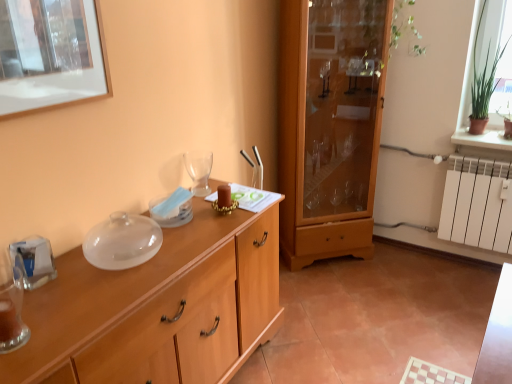
The width and height of the screenshot is (512, 384). Describe the element at coordinates (330, 125) in the screenshot. I see `wooden cabinet at center` at that location.

Find the location of `translucent glass vase at left`. translucent glass vase at left is located at coordinates (12, 315).

What is the approximate width of transparent glass wine glass at center?

It is 11.53 centimeters.

The image size is (512, 384). Identify the location of wooden picture frame at upper left. (51, 54).

In the image, is wooden picture frame at upper left on the left side or the right side of translucent glass vase at left?

Based on their positions, wooden picture frame at upper left is located to the right of translucent glass vase at left.

Locate an element on the screen. The width and height of the screenshot is (512, 384). tableware that appears in front of the wooden picture frame at upper left is located at coordinates (12, 315).

Is wooden picture frame at upper left not near translucent glass vase at left?

No, wooden picture frame at upper left is in close proximity to translucent glass vase at left.

Which object is closer to the camera, wooden cabinet at center or transparent glass wine glass at center?

transparent glass wine glass at center is more forward.

Locate an element on the screen. wine glass lying in front of the wooden cabinet at center is located at coordinates (199, 170).

Consider the image. Is wooden cabinet at center looking in the opposite direction of transparent glass wine glass at center?

No, transparent glass wine glass at center is not at the back of wooden cabinet at center.

Is wooden cabinet at center smaller than wooden picture frame at upper left?

Incorrect, wooden cabinet at center is not smaller in size than wooden picture frame at upper left.

Relative to wooden picture frame at upper left, is wooden cabinet at center in front or behind?

In the image, wooden cabinet at center appears behind wooden picture frame at upper left.

From the image's perspective, is wooden cabinet at center located above wooden picture frame at upper left?

No.

Can wooden cabinet at center be found inside wooden cabinet at center?

No.

Is wooden cabinet at center far from wooden cabinet at center?

wooden cabinet at center is far away from wooden cabinet at center.

From a real-world perspective, between wooden cabinet at center and wooden cabinet at center, who is vertically higher?

From a 3D spatial view, wooden cabinet at center is above.

From the picture: Is wooden cabinet at center behind wooden cabinet at center?

No, wooden cabinet at center is closer to the camera.

Between translucent glass vase at left and wooden cabinet at center, which one has larger size?

wooden cabinet at center.

From a real-world perspective, is translucent glass vase at left physically located above or below wooden cabinet at center?

translucent glass vase at left is situated higher than wooden cabinet at center in the real world.

Measure the distance between translucent glass vase at left and wooden cabinet at center.

They are 6.23 feet apart.

Considering the sizes of objects translucent glass vase at left and wooden cabinet at center in the image provided, who is taller, translucent glass vase at left or wooden cabinet at center?

Standing taller between the two is wooden cabinet at center.

Is point (1, 312) positioned before point (99, 46)?

Yes.

Is translucent glass vase at left not inside wooden picture frame at upper left?

That's correct, translucent glass vase at left is outside of wooden picture frame at upper left.

Is translucent glass vase at left thinner than wooden picture frame at upper left?

Incorrect, the width of translucent glass vase at left is not less than that of wooden picture frame at upper left.

Looking at the image, does wooden picture frame at upper left seem bigger or smaller compared to wooden cabinet at center?

Considering their sizes, wooden picture frame at upper left takes up less space than wooden cabinet at center.

Which object is positioned more to the left, wooden picture frame at upper left or wooden cabinet at center?

wooden picture frame at upper left.

From the image's perspective, who appears lower, wooden picture frame at upper left or wooden cabinet at center?

wooden cabinet at center is shown below in the image.

Does wooden picture frame at upper left come in front of wooden cabinet at center?

No, wooden picture frame at upper left is further to the viewer.

Identify the location of tableware in front of the wooden picture frame at upper left. (12, 315).

At what (x,y) coordinates should I click in order to perform the action: click on wine glass that is above the wooden cabinet at center (from a real-world perspective). Please return your answer as a coordinate pair (x, y). This screenshot has width=512, height=384. Looking at the image, I should click on (199, 170).

When comparing their distances from wooden cabinet at center, does transparent glass wine glass at center or translucent glass vase at left seem closer?

translucent glass vase at left is positioned closer to the anchor wooden cabinet at center.

When comparing their distances from wooden cabinet at center, does translucent glass vase at left or wooden picture frame at upper left seem further?

The object further to wooden cabinet at center is wooden picture frame at upper left.

Considering their positions, is wooden picture frame at upper left positioned closer to translucent glass vase at left than transparent glass wine glass at center?

wooden picture frame at upper left is positioned closer to the anchor translucent glass vase at left.

Considering their positions, is wooden cabinet at center positioned closer to translucent glass vase at left than transparent glass wine glass at center?

wooden cabinet at center is positioned closer to the anchor translucent glass vase at left.

When comparing their distances from translucent glass vase at left, does wooden cabinet at center or wooden picture frame at upper left seem further?

wooden picture frame at upper left lies further to translucent glass vase at left than the other object.

When comparing their distances from transparent glass wine glass at center, does wooden cabinet at center or wooden cabinet at center seem further?

Among the two, wooden cabinet at center is located further to transparent glass wine glass at center.

Which object lies nearer to the anchor point transparent glass wine glass at center, wooden picture frame at upper left or wooden cabinet at center?

Among the two, wooden picture frame at upper left is located nearer to transparent glass wine glass at center.

Looking at the image, which one is located closer to wooden picture frame at upper left, wooden cabinet at center or transparent glass wine glass at center?

The object closer to wooden picture frame at upper left is transparent glass wine glass at center.

What are the coordinates of `wine glass between translucent glass vase at left and wooden cabinet at center from left to right` in the screenshot? It's located at (199, 170).

Locate an element on the screen. picture frame between wooden cabinet at center and transparent glass wine glass at center in the front-back direction is located at coordinates (51, 54).

Where is `tableware between wooden cabinet at center and transparent glass wine glass at center along the z-axis`? The height and width of the screenshot is (384, 512). tableware between wooden cabinet at center and transparent glass wine glass at center along the z-axis is located at coordinates (12, 315).

Identify the location of tableware between wooden picture frame at upper left and wooden cabinet at center vertically. The height and width of the screenshot is (384, 512). (12, 315).